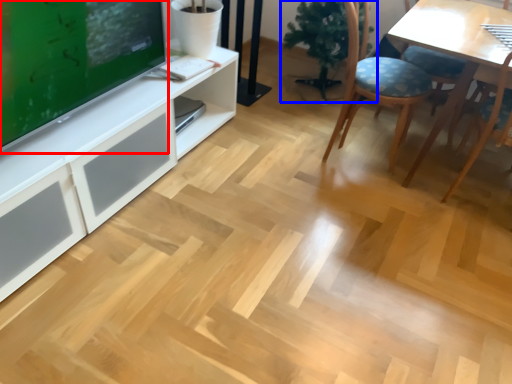
Question: Among these objects, which one is nearest to the camera, television (highlighted by a red box) or houseplant (highlighted by a blue box)?

Choices:
 (A) television
 (B) houseplant

Answer: (A)